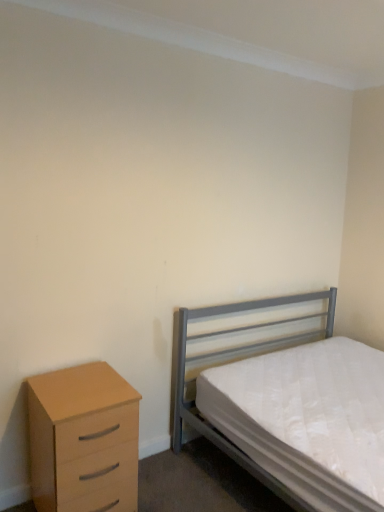
Question: From a real-world perspective, is metallic gray bed at right under light wood/veneer chest of drawers at left?

Choices:
 (A) yes
 (B) no

Answer: (B)

Question: Is light wood/veneer chest of drawers at left surrounded by metallic gray bed at right?

Choices:
 (A) no
 (B) yes

Answer: (A)

Question: Is the position of metallic gray bed at right less distant than that of light wood/veneer chest of drawers at left?

Choices:
 (A) yes
 (B) no

Answer: (A)

Question: Is metallic gray bed at right at the right side of light wood/veneer chest of drawers at left?

Choices:
 (A) no
 (B) yes

Answer: (B)

Question: Is metallic gray bed at right not within light wood/veneer chest of drawers at left?

Choices:
 (A) no
 (B) yes

Answer: (B)

Question: Is metallic gray bed at right to the left of light wood/veneer chest of drawers at left from the viewer's perspective?

Choices:
 (A) no
 (B) yes

Answer: (A)

Question: Can you confirm if light wood/veneer chest of drawers at left is positioned to the right of metallic gray bed at right?

Choices:
 (A) yes
 (B) no

Answer: (B)

Question: From a real-world perspective, is light wood/veneer chest of drawers at left physically above metallic gray bed at right?

Choices:
 (A) yes
 (B) no

Answer: (B)

Question: Is light wood/veneer chest of drawers at left not within metallic gray bed at right?

Choices:
 (A) no
 (B) yes

Answer: (B)

Question: Is light wood/veneer chest of drawers at left wider than metallic gray bed at right?

Choices:
 (A) no
 (B) yes

Answer: (A)

Question: From the image's perspective, is light wood/veneer chest of drawers at left under metallic gray bed at right?

Choices:
 (A) no
 (B) yes

Answer: (B)

Question: From a real-world perspective, does light wood/veneer chest of drawers at left sit lower than metallic gray bed at right?

Choices:
 (A) no
 (B) yes

Answer: (B)

Question: Considering the positions of point (132, 422) and point (289, 296), is point (132, 422) closer or farther from the camera than point (289, 296)?

Choices:
 (A) closer
 (B) farther

Answer: (A)